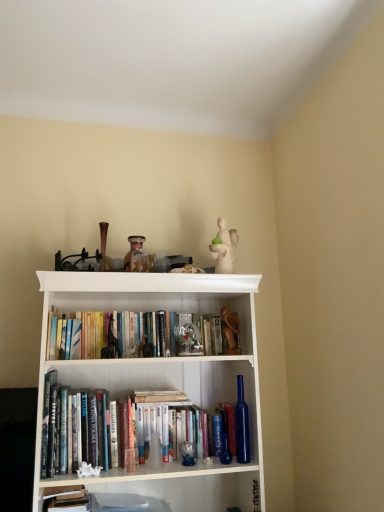
You are a GUI agent. You are given a task and a screenshot of the screen. Output one action in this format:
    pyautogui.click(x=<x>, y=<y>)
    Task: Click on the free space above hardcover books at center, arranged as the 1th book when viewed from the back (from a real-world perspective)
    
    Given the screenshot: What is the action you would take?
    pyautogui.click(x=150, y=312)